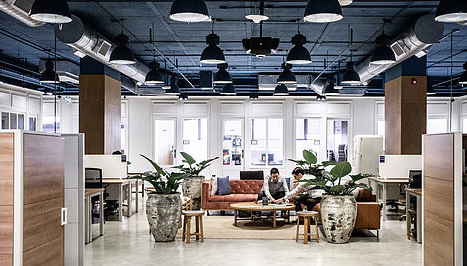
I want to click on 5 desks, so 415,197, 95,197, 122,185, 136,180, 391,175.